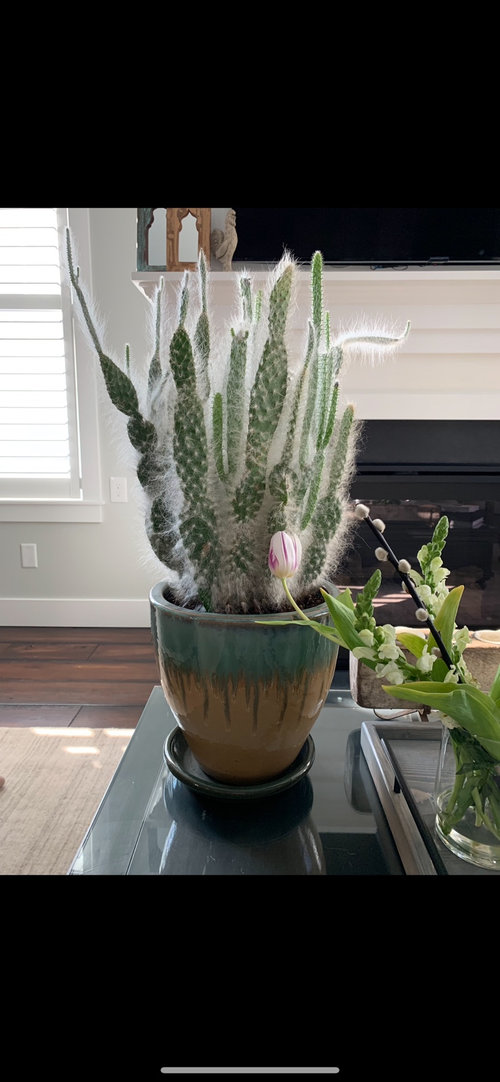
I want to click on vase, so click(217, 753).